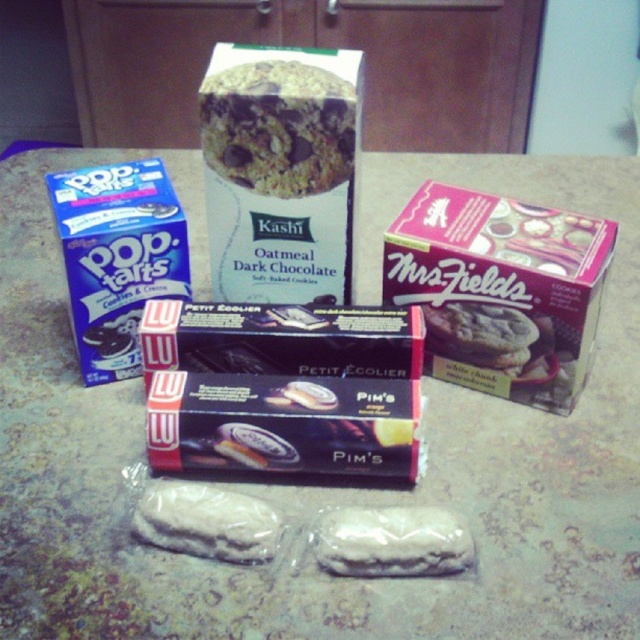
Between pink matte mrsfields cookies at upper right and white matte cookie at center, which one appears on the right side from the viewer's perspective?

pink matte mrsfields cookies at upper right

Locate an element on the screen. pink matte mrsfields cookies at upper right is located at coordinates (500, 291).

This screenshot has width=640, height=640. In order to click on pink matte mrsfields cookies at upper right in this screenshot , I will do `click(500, 291)`.

Does pink matte mrsfields cookies at upper right appear over blue matte pop-tarts at left?

No.

Between pink matte mrsfields cookies at upper right and blue matte pop-tarts at left, which one appears on the right side from the viewer's perspective?

From the viewer's perspective, pink matte mrsfields cookies at upper right appears more on the right side.

Which is behind, point (579, 385) or point (106, 205)?

Positioned behind is point (106, 205).

Locate an element on the screen. pink matte mrsfields cookies at upper right is located at coordinates (500, 291).

Does blue matte pop-tarts at left have a lesser height compared to white matte cookie at center?

In fact, blue matte pop-tarts at left may be taller than white matte cookie at center.

Does point (124, 337) come closer to viewer compared to point (454, 572)?

No, (124, 337) is further to viewer.

This screenshot has height=640, width=640. Find the location of `blue matte pop-tarts at left`. blue matte pop-tarts at left is located at coordinates (116, 257).